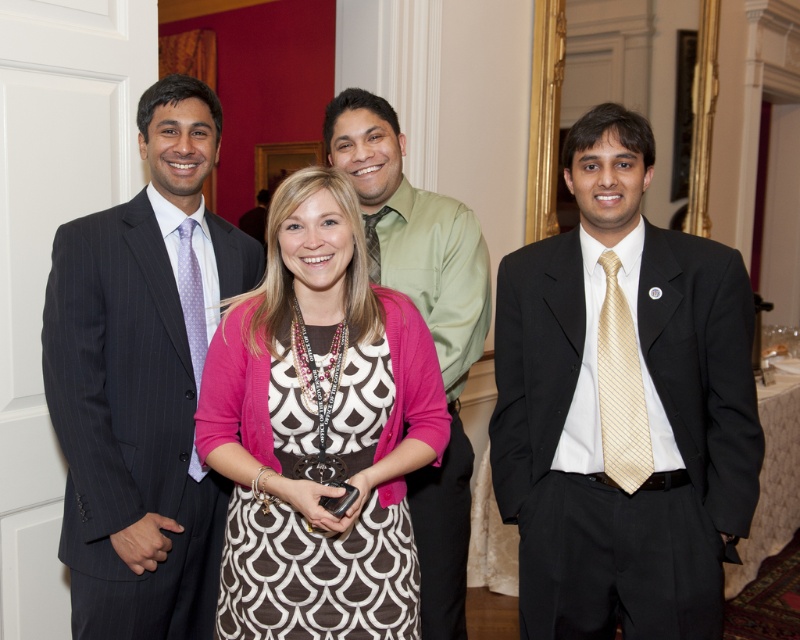
You are a photographer adjusting the camera settings to ensure all subjects are in focus. The matte black suit at center and the gold striped tie at right are both in your frame. Which subject should you focus on first to ensure the closest subject is sharp?

The gold striped tie at right is closer to you than the matte black suit at center, so you should focus on the gold striped tie at right first to ensure the closest subject is sharp.

You are a photographer at the event and want to capture a closeup of the gold striped tie at right without including the matte black suit at center in the frame. Is this possible based on their positions?

The matte black suit at center is to the right of the gold striped tie at right, so they are positioned next to each other. To avoid including the matte black suit at center in the frame, you would need to adjust the camera angle or zoom in closely on the gold striped tie at right to exclude the nearby matte black suit at center.

You are a photographer standing 1.5 meters away from the woman in the pink cardigan. You want to take a photo of the matte black suit at left. Can you reach it without moving closer than 1.5 meters?

The distance between the photographer and the matte black suit at left is 1.64 meters. Since the photographer is already 1.5 meters away, they can reach the matte black suit at left without moving closer.